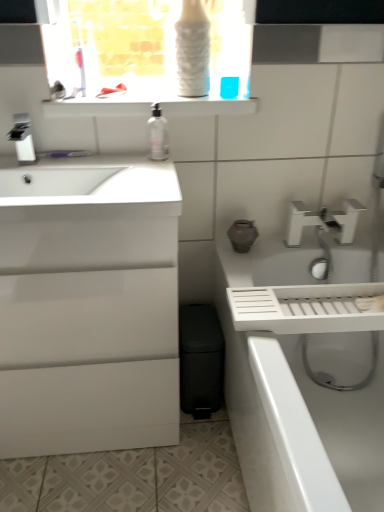
Question: Can you confirm if white glossy cabinet at left is bigger than clear plastic bottle at center?

Choices:
 (A) no
 (B) yes

Answer: (B)

Question: Is white glossy cabinet at left outside of clear plastic bottle at center?

Choices:
 (A) no
 (B) yes

Answer: (B)

Question: Is white glossy cabinet at left next to clear plastic bottle at center?

Choices:
 (A) no
 (B) yes

Answer: (A)

Question: Considering the relative positions of white glossy cabinet at left and clear plastic bottle at center in the image provided, is white glossy cabinet at left to the right of clear plastic bottle at center from the viewer's perspective?

Choices:
 (A) no
 (B) yes

Answer: (A)

Question: Are white glossy cabinet at left and clear plastic bottle at center located far from each other?

Choices:
 (A) yes
 (B) no

Answer: (B)

Question: Considering the positions of satin nickel faucet at upper left, which ranks as the second tap in bottom-to-top order, and white glossy shelf at upper center in the image, is satin nickel faucet at upper left, which ranks as the second tap in bottom-to-top order, wider or thinner than white glossy shelf at upper center?

Choices:
 (A) thin
 (B) wide

Answer: (A)

Question: Is satin nickel faucet at upper left, marked as the first tap in a top-to-bottom arrangement, in front of or behind white glossy shelf at upper center in the image?

Choices:
 (A) front
 (B) behind

Answer: (A)

Question: Which is correct: satin nickel faucet at upper left, arranged as the 1th tap when viewed from the front, is inside white glossy shelf at upper center, or outside of it?

Choices:
 (A) outside
 (B) inside

Answer: (A)

Question: From a real-world perspective, is satin nickel faucet at upper left, arranged as the 2th tap when viewed from the back, physically located above or below white glossy shelf at upper center?

Choices:
 (A) below
 (B) above

Answer: (A)

Question: Looking at their shapes, would you say white glossy cabinet at left is wider or thinner than white glossy shelf at upper center?

Choices:
 (A) thin
 (B) wide

Answer: (B)

Question: In terms of height, does white glossy cabinet at left look taller or shorter compared to white glossy shelf at upper center?

Choices:
 (A) tall
 (B) short

Answer: (A)

Question: Does point (29, 307) appear closer or farther from the camera than point (244, 103)?

Choices:
 (A) closer
 (B) farther

Answer: (A)

Question: Is white glossy cabinet at left situated inside white glossy shelf at upper center or outside?

Choices:
 (A) inside
 (B) outside

Answer: (B)

Question: Considering the positions of white glossy bath at right and satin nickel faucet at upper left, marked as the first tap in a top-to-bottom arrangement, in the image, is white glossy bath at right taller or shorter than satin nickel faucet at upper left, marked as the first tap in a top-to-bottom arrangement,?

Choices:
 (A) short
 (B) tall

Answer: (B)

Question: Visually, is white glossy bath at right positioned to the left or to the right of satin nickel faucet at upper left, arranged as the 1th tap when viewed from the front?

Choices:
 (A) left
 (B) right

Answer: (B)